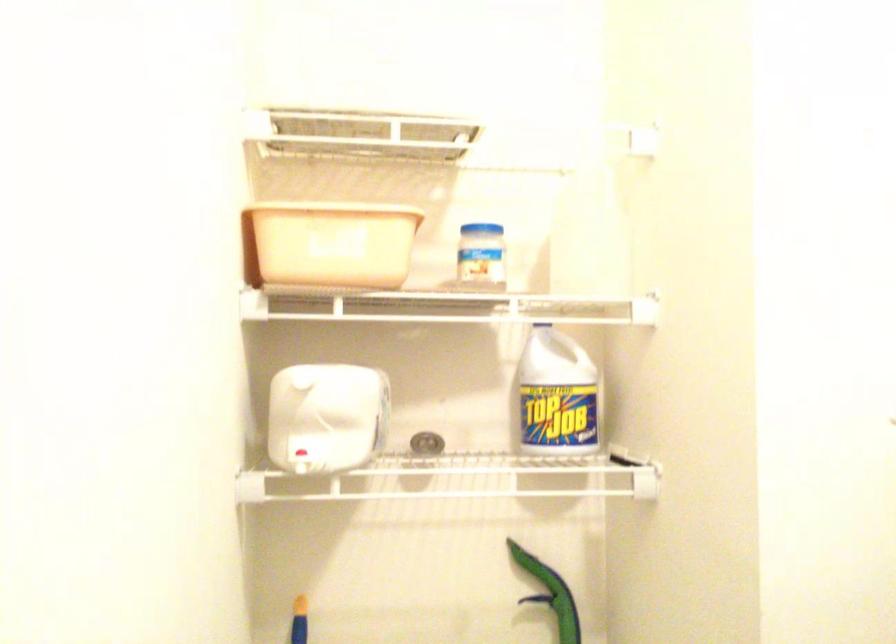
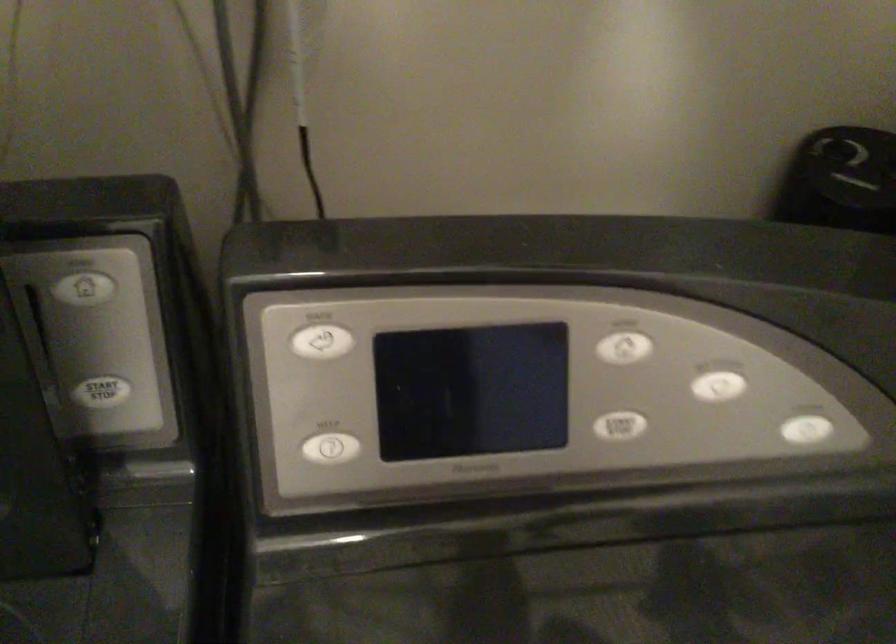
Based on the continuous images, in which direction is the camera rotating?

The camera's rotation is toward right-down.